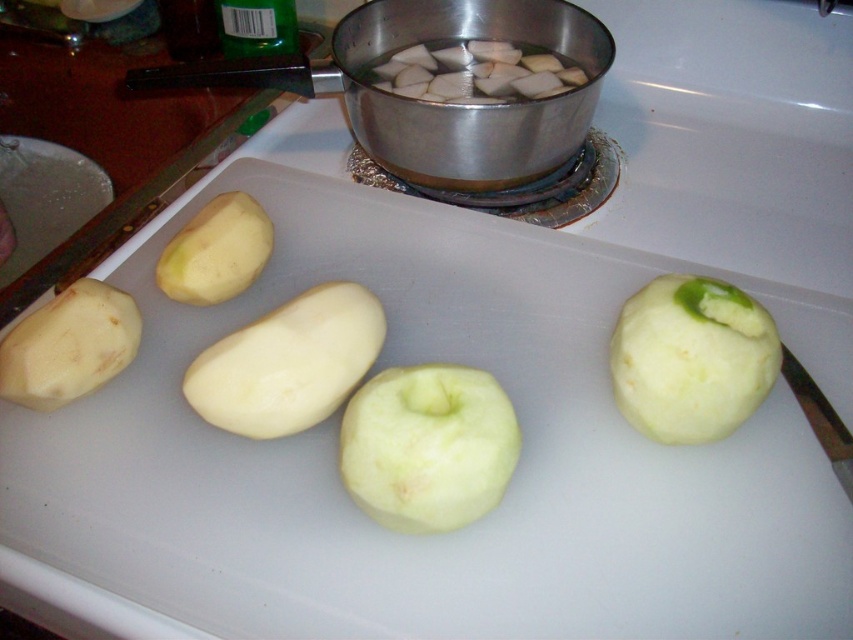
You are a chef preparing ingredients for a potato salad. You have a smooth white potato at center on your cutting board. If you need to reach for a knife that is 12 inches away from you, will you be able to grab it without moving your current position? Explain your reasoning based on the distance provided.

The smooth white potato at center is 15.90 inches away from the viewer. Since the knife is only 12 inches away, it is closer than the potato. Therefore, you can reach the knife without moving your position as it is within arm reach.

You are a chef organizing ingredients on a kitchen counter. You have a green matte apple at center. Where should you place it so that it doesn

The green matte apple at center should be placed at the point with coordinates [428,445] to match its current 2D location in the scene.